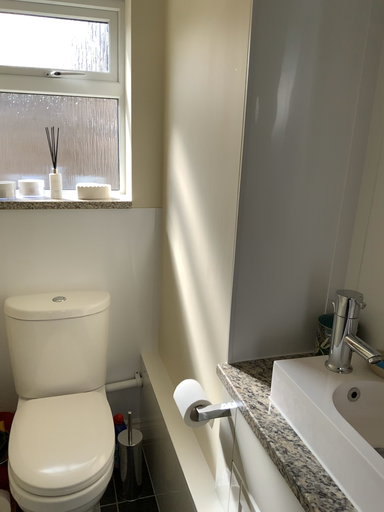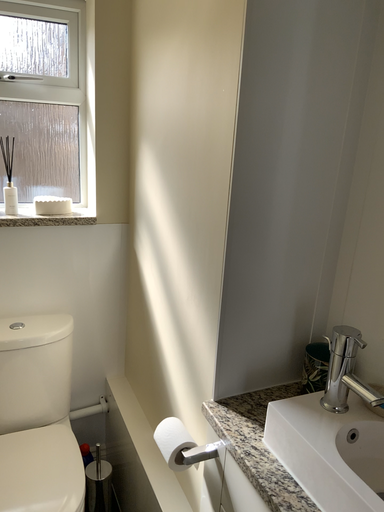
Question: How did the camera likely rotate when shooting the video?

Choices:
 (A) rotated right
 (B) rotated left

Answer: (A)